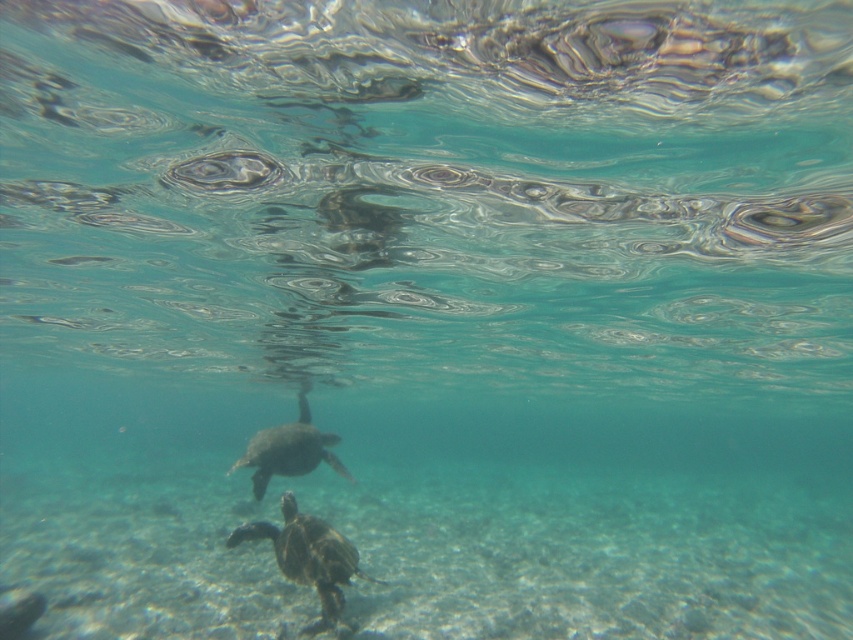
Question: Among these objects, which one is farthest from the camera?

Choices:
 (A) smooth gray turtle at center
 (B) green textured shell at center

Answer: (A)

Question: Which point is farther from the camera taking this photo?

Choices:
 (A) (355, 557)
 (B) (339, 461)

Answer: (B)

Question: Is green textured shell at center smaller than smooth gray turtle at center?

Choices:
 (A) no
 (B) yes

Answer: (B)

Question: Does green textured shell at center have a lesser width compared to smooth gray turtle at center?

Choices:
 (A) no
 (B) yes

Answer: (B)

Question: Can you confirm if green textured shell at center is thinner than smooth gray turtle at center?

Choices:
 (A) yes
 (B) no

Answer: (A)

Question: Among these points, which one is farthest from the camera?

Choices:
 (A) (299, 540)
 (B) (277, 460)

Answer: (B)